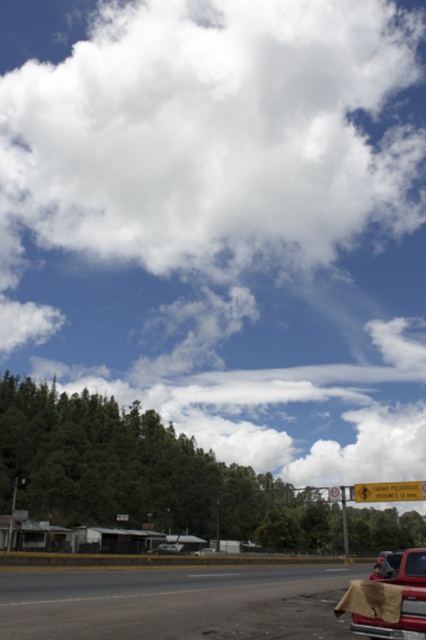
Question: Which of the following is the closest to the observer?

Choices:
 (A) red matte truck at lower right
 (B) silver metallic sedan at center
 (C) yellow plastic sign at upper center
 (D) metallic silver car at center

Answer: (A)

Question: Does yellow plastic sign at upper center appear over silver metallic sedan at center?

Choices:
 (A) yes
 (B) no

Answer: (B)

Question: Estimate the real-world distances between objects in this image. Which object is farther from the white fluffy cloud at upper center?

Choices:
 (A) silver metallic sedan at center
 (B) red matte truck at lower right
 (C) asphalt road at lower center

Answer: (B)

Question: Is yellow plastic sign at upper center bigger than metallic silver car at center?

Choices:
 (A) yes
 (B) no

Answer: (A)

Question: Is red matte truck at lower right smaller than metallic silver car at center?

Choices:
 (A) yes
 (B) no

Answer: (B)

Question: Based on their relative distances, which object is farther from the metallic pole at center?

Choices:
 (A) white fluffy cloud at upper center
 (B) red matte truck at lower right
 (C) asphalt road at lower center

Answer: (A)